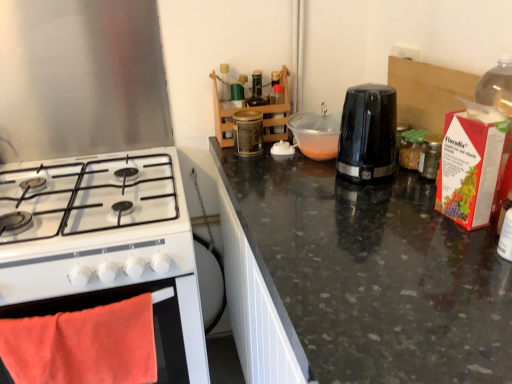
What do you see at coordinates (368, 132) in the screenshot?
I see `black plastic toaster at center, the first kitchen appliance from the right` at bounding box center [368, 132].

Measure the distance between point (390, 139) and camera.

A distance of 3.64 feet exists between point (390, 139) and camera.

Identify the location of orange fabric oven at lower left. (155, 323).

This screenshot has width=512, height=384. In order to click on black plastic toaster at center, the first kitchen appliance from the right in this screenshot , I will do point(368,132).

Which object is positioned more to the left, metallic gold canister at center or black plastic toaster at center, the first kitchen appliance from the right?

Positioned to the left is metallic gold canister at center.

Which is correct: metallic gold canister at center is inside black plastic toaster at center, the first kitchen appliance from the right, or outside of it?

metallic gold canister at center lies outside black plastic toaster at center, the first kitchen appliance from the right.

From a real-world perspective, is metallic gold canister at center located higher than black plastic toaster at center, arranged as the second kitchen appliance when viewed from the left?

Incorrect, from a real-world perspective, metallic gold canister at center is lower than black plastic toaster at center, arranged as the second kitchen appliance when viewed from the left.

You are a GUI agent. You are given a task and a screenshot of the screen. Output one action in this format:
    pyautogui.click(x=<x>, y=<y>)
    Task: Click on the bottle that appears behind the black plastic toaster at center, arranged as the second kitchen appliance when viewed from the left
    This screenshot has height=384, width=512.
    Given the screenshot: What is the action you would take?
    pyautogui.click(x=248, y=132)

Between metallic gold canister at center and orange fabric oven at lower left, which one is positioned in front?

orange fabric oven at lower left is closer to the camera.

Considering the relative sizes of metallic gold canister at center and orange fabric oven at lower left in the image provided, is metallic gold canister at center smaller than orange fabric oven at lower left?

Correct, metallic gold canister at center occupies less space than orange fabric oven at lower left.

From the image's perspective, does metallic gold canister at center appear lower than orange fabric oven at lower left?

Incorrect, from the image's perspective, metallic gold canister at center is higher than orange fabric oven at lower left.

From the picture: Is metallic gold canister at center located outside orange fabric oven at lower left?

Absolutely, metallic gold canister at center is external to orange fabric oven at lower left.

Is orange fabric oven at lower left next to metallic gold canister at center?

orange fabric oven at lower left is not next to metallic gold canister at center, and they're not touching.

Which of these two, orange fabric oven at lower left or metallic gold canister at center, is smaller?

metallic gold canister at center is smaller.

Is orange fabric oven at lower left turned away from metallic gold canister at center?

No, orange fabric oven at lower left is not facing the opposite direction of metallic gold canister at center.

Considering the positions of points (101, 294) and (256, 131), is point (101, 294) closer to camera compared to point (256, 131)?

Yes, it is in front of point (256, 131).

Which point is more distant from viewer, (390, 123) or (232, 116)?

Point (232, 116)

Would you say black plastic toaster at center, the first kitchen appliance from the right, contains metallic gold canister at center?

No, black plastic toaster at center, the first kitchen appliance from the right, does not contain metallic gold canister at center.

Which object is wider, black plastic toaster at center, the first kitchen appliance from the right, or metallic gold canister at center?

With larger width is black plastic toaster at center, the first kitchen appliance from the right.

Does point (164, 316) appear closer or farther from the camera than point (165, 300)?

Point (164, 316) appears to be farther away from the viewer than point (165, 300).

Is orange fabric oven at lower left taller than white glossy gas stove at left, which appears as the 1th kitchen appliance when viewed from the left?

Indeed, orange fabric oven at lower left has a greater height compared to white glossy gas stove at left, which appears as the 1th kitchen appliance when viewed from the left.

Is orange fabric oven at lower left bigger than white glossy gas stove at left, which is the second kitchen appliance in right-to-left order?

Actually, orange fabric oven at lower left might be smaller than white glossy gas stove at left, which is the second kitchen appliance in right-to-left order.

From a real-world perspective, is orange fabric oven at lower left positioned under white glossy gas stove at left, which is the second kitchen appliance in right-to-left order, based on gravity?

Yes, from a real-world perspective, orange fabric oven at lower left is beneath white glossy gas stove at left, which is the second kitchen appliance in right-to-left order.

From a real-world perspective, relative to orange fabric oven at lower left, is white glossy gas stove at left, which appears as the 1th kitchen appliance when viewed from the left, vertically above or below?

In terms of real-world spatial position, white glossy gas stove at left, which appears as the 1th kitchen appliance when viewed from the left, is above orange fabric oven at lower left.

Considering the relative sizes of white glossy gas stove at left, which is the second kitchen appliance in right-to-left order, and orange fabric oven at lower left in the image provided, is white glossy gas stove at left, which is the second kitchen appliance in right-to-left order, shorter than orange fabric oven at lower left?

Yes.

Does white glossy gas stove at left, which is the second kitchen appliance in right-to-left order, come in front of orange fabric oven at lower left?

Yes, white glossy gas stove at left, which is the second kitchen appliance in right-to-left order, is in front of orange fabric oven at lower left.

From the image's perspective, between white glossy gas stove at left, which appears as the 1th kitchen appliance when viewed from the left, and orange fabric oven at lower left, who is located below?

From the image's view, orange fabric oven at lower left is below.

Considering the relative positions of orange fabric oven at lower left and black plastic toaster at center, the first kitchen appliance from the right, in the image provided, is orange fabric oven at lower left in front of black plastic toaster at center, the first kitchen appliance from the right,?

Yes, the depth of orange fabric oven at lower left is less than that of black plastic toaster at center, the first kitchen appliance from the right.

Where is `the 2nd kitchen appliance directly above the orange fabric oven at lower left (from a real-world perspective)`? This screenshot has width=512, height=384. the 2nd kitchen appliance directly above the orange fabric oven at lower left (from a real-world perspective) is located at coordinates (368, 132).

Is orange fabric oven at lower left situated inside black plastic toaster at center, arranged as the second kitchen appliance when viewed from the left, or outside?

orange fabric oven at lower left is located beyond the bounds of black plastic toaster at center, arranged as the second kitchen appliance when viewed from the left.

Could you tell me if orange fabric oven at lower left is turned towards black plastic toaster at center, arranged as the second kitchen appliance when viewed from the left?

No, orange fabric oven at lower left is not aimed at black plastic toaster at center, arranged as the second kitchen appliance when viewed from the left.

Locate an element on the screen. The height and width of the screenshot is (384, 512). kitchen appliance located above the metallic gold canister at center (from a real-world perspective) is located at coordinates (368, 132).

The image size is (512, 384). I want to click on oven in front of the metallic gold canister at center, so click(155, 323).

Estimate the real-world distances between objects in this image. Which object is closer to orange fabric oven at lower left, black plastic toaster at center, the first kitchen appliance from the right, or white glossy gas stove at left, which is the second kitchen appliance in right-to-left order?

Based on the image, white glossy gas stove at left, which is the second kitchen appliance in right-to-left order, appears to be nearer to orange fabric oven at lower left.

Looking at the image, which one is located further to white glossy gas stove at left, which appears as the 1th kitchen appliance when viewed from the left, black plastic toaster at center, the first kitchen appliance from the right, or orange fabric oven at lower left?

The object further to white glossy gas stove at left, which appears as the 1th kitchen appliance when viewed from the left, is black plastic toaster at center, the first kitchen appliance from the right.

From the image, which object appears to be nearer to metallic gold canister at center, white glossy gas stove at left, which appears as the 1th kitchen appliance when viewed from the left, or orange fabric oven at lower left?

Based on the image, white glossy gas stove at left, which appears as the 1th kitchen appliance when viewed from the left, appears to be nearer to metallic gold canister at center.

Based on their spatial positions, is orange fabric oven at lower left or metallic gold canister at center further from white glossy gas stove at left, which appears as the 1th kitchen appliance when viewed from the left?

metallic gold canister at center is positioned further to the anchor white glossy gas stove at left, which appears as the 1th kitchen appliance when viewed from the left.

Which object lies nearer to the anchor point orange fabric oven at lower left, metallic gold canister at center or black plastic toaster at center, arranged as the second kitchen appliance when viewed from the left?

metallic gold canister at center lies closer to orange fabric oven at lower left than the other object.

Based on their spatial positions, is metallic gold canister at center or orange fabric oven at lower left closer to black plastic toaster at center, the first kitchen appliance from the right?

Based on the image, metallic gold canister at center appears to be nearer to black plastic toaster at center, the first kitchen appliance from the right.

When comparing their distances from black plastic toaster at center, the first kitchen appliance from the right, does metallic gold canister at center or white glossy gas stove at left, which appears as the 1th kitchen appliance when viewed from the left, seem further?

The object further to black plastic toaster at center, the first kitchen appliance from the right, is white glossy gas stove at left, which appears as the 1th kitchen appliance when viewed from the left.

From the image, which object appears to be farther from white glossy gas stove at left, which appears as the 1th kitchen appliance when viewed from the left, black plastic toaster at center, the first kitchen appliance from the right, or metallic gold canister at center?

black plastic toaster at center, the first kitchen appliance from the right, is further to white glossy gas stove at left, which appears as the 1th kitchen appliance when viewed from the left.

Where is `oven between white glossy gas stove at left, which is the second kitchen appliance in right-to-left order, and black plastic toaster at center, the first kitchen appliance from the right, from left to right`? oven between white glossy gas stove at left, which is the second kitchen appliance in right-to-left order, and black plastic toaster at center, the first kitchen appliance from the right, from left to right is located at coordinates (155, 323).

Where is `bottle between orange fabric oven at lower left and black plastic toaster at center, the first kitchen appliance from the right`? Image resolution: width=512 pixels, height=384 pixels. bottle between orange fabric oven at lower left and black plastic toaster at center, the first kitchen appliance from the right is located at coordinates (248, 132).

Locate an element on the screen. bottle located between white glossy gas stove at left, which is the second kitchen appliance in right-to-left order, and black plastic toaster at center, arranged as the second kitchen appliance when viewed from the left, in the left-right direction is located at coordinates (248, 132).